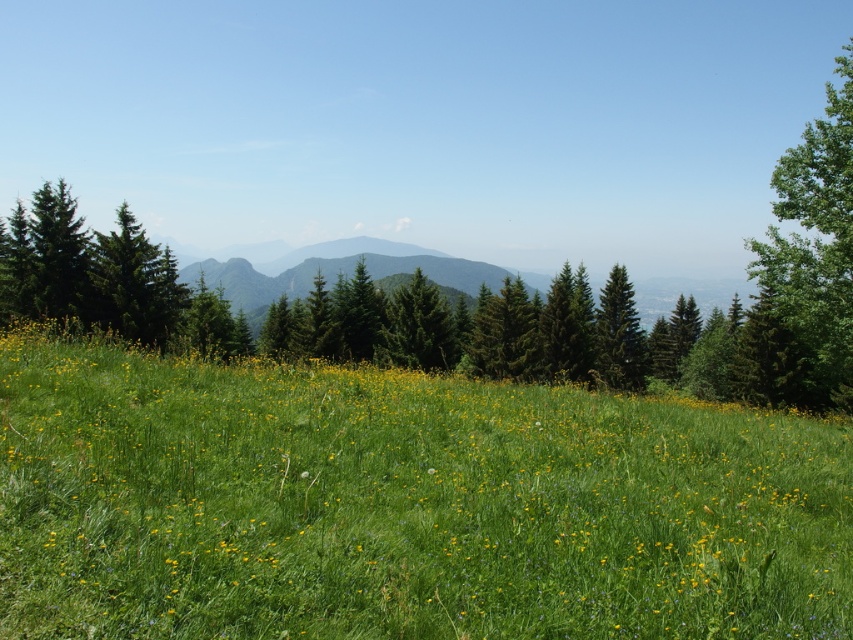
You are standing in the meadow and want to walk from the green matte tree at left to the green matte tree at right. Which direction should you face to walk directly towards the tree?

You should face to the right because the green matte tree at right is positioned to the right of the green matte tree at left.

You are a hiker standing in the middle of the green grass at center. You want to take a photo of the green matte tree at center in the background. Can you see the entire tree in your camera frame without moving your position?

The green grass at center is smaller than the green matte tree at center, so the tree is taller than the grass. Since you are standing on the green grass at center, the tree might block part of the view, but you can still see the entire tree in your camera frame as long as you adjust the angle slightly upwards to include its full height.